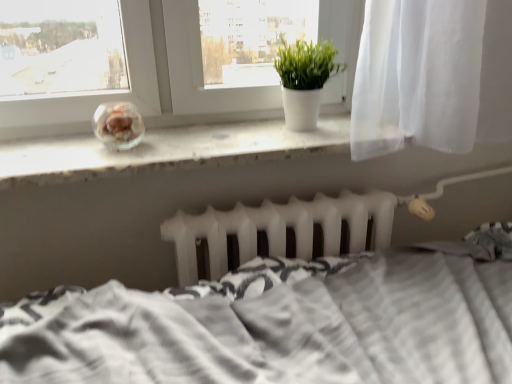
Question: From a real-world perspective, is white textured bed at center positioned above or below white matte window sill at center?

Choices:
 (A) above
 (B) below

Answer: (B)

Question: Is white textured bed at center bigger or smaller than white matte window sill at center?

Choices:
 (A) small
 (B) big

Answer: (B)

Question: Considering the real-world distances, which object is farthest from the translucent glass jar at center?

Choices:
 (A) white textured bed at center
 (B) white matte window sill at center
 (C) green matte plant at center
 (D) white matte radiator at center

Answer: (A)

Question: Estimate the real-world distances between objects in this image. Which object is closer to the white matte window sill at center?

Choices:
 (A) white matte radiator at center
 (B) white textured bed at center
 (C) translucent glass jar at center
 (D) green matte plant at center

Answer: (C)